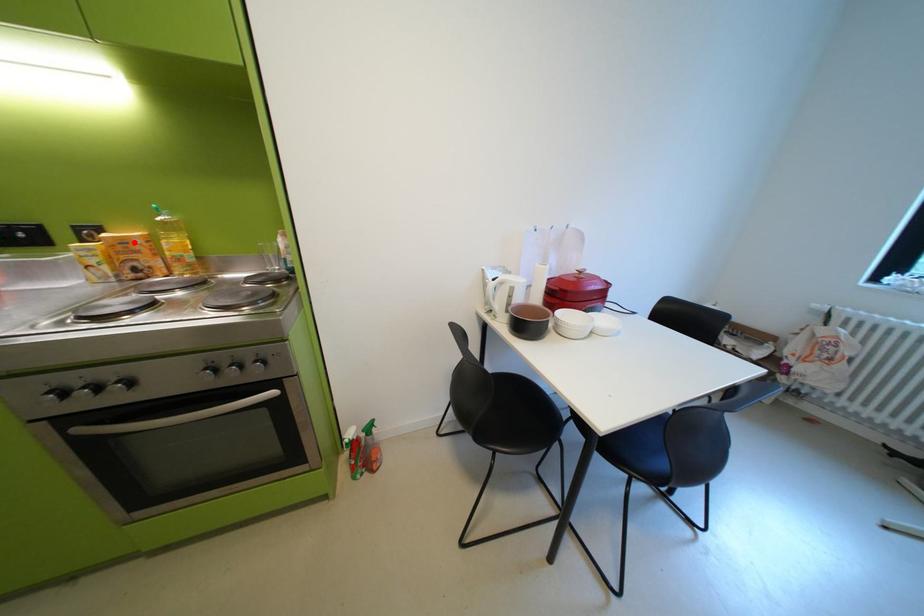
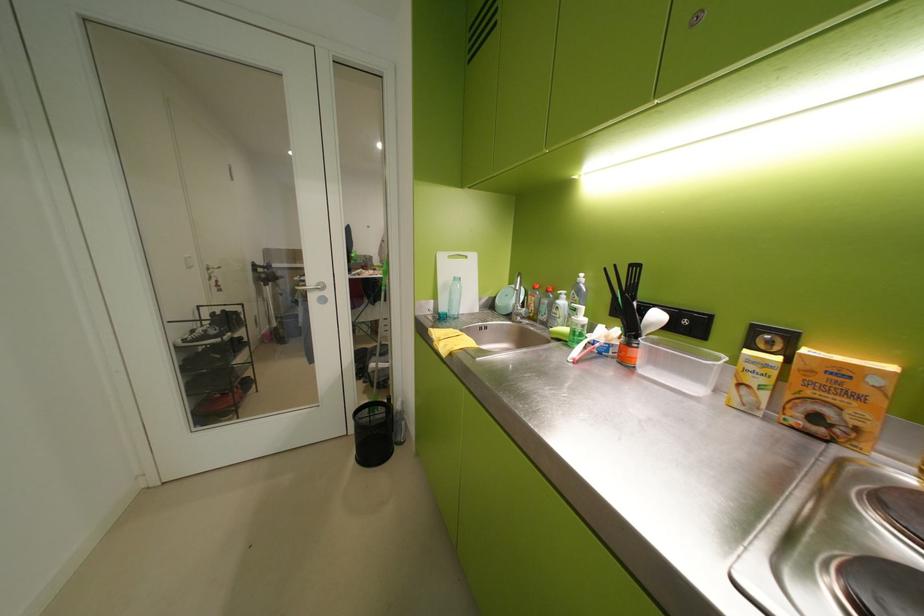
Question: I am providing you with two images of the same scene from different viewpoints. A red point is marked on the first image. Is the red point's position out of view in image 2?

Choices:
 (A) Yes
 (B) No

Answer: (B)